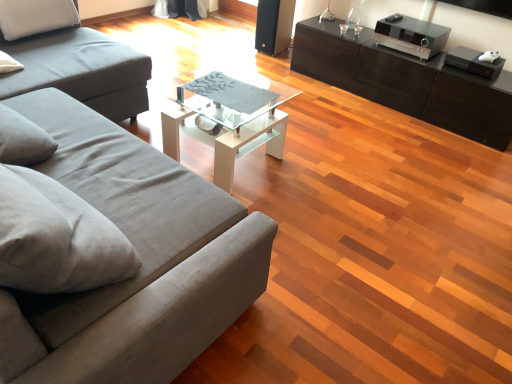
Question: Are clear glass coffee table at center and matte gray fabric studio couch at left, arranged as the 1th studio couch when viewed from the back, making contact?

Choices:
 (A) no
 (B) yes

Answer: (A)

Question: Could you tell me if clear glass coffee table at center is turned towards matte gray fabric studio couch at left, arranged as the 2th studio couch when viewed from the front?

Choices:
 (A) yes
 (B) no

Answer: (B)

Question: Is matte gray fabric studio couch at left, arranged as the 1th studio couch when viewed from the back, surrounded by clear glass coffee table at center?

Choices:
 (A) yes
 (B) no

Answer: (B)

Question: From a real-world perspective, is clear glass coffee table at center positioned under matte gray fabric studio couch at left, arranged as the 1th studio couch when viewed from the back, based on gravity?

Choices:
 (A) no
 (B) yes

Answer: (B)

Question: Is clear glass coffee table at center wider than matte gray fabric studio couch at left, arranged as the 1th studio couch when viewed from the back?

Choices:
 (A) no
 (B) yes

Answer: (A)

Question: Is gray fabric couch at left, the first studio couch when ordered from front to back, inside or outside of clear glass coffee table at center?

Choices:
 (A) inside
 (B) outside

Answer: (B)

Question: Considering the positions of gray fabric couch at left, the first studio couch when ordered from front to back, and clear glass coffee table at center in the image, is gray fabric couch at left, the first studio couch when ordered from front to back, wider or thinner than clear glass coffee table at center?

Choices:
 (A) thin
 (B) wide

Answer: (B)

Question: Is gray fabric couch at left, the first studio couch when ordered from front to back, in front of or behind clear glass coffee table at center in the image?

Choices:
 (A) behind
 (B) front

Answer: (B)

Question: From their relative heights in the image, would you say gray fabric couch at left, the second studio couch positioned from the back, is taller or shorter than clear glass coffee table at center?

Choices:
 (A) short
 (B) tall

Answer: (B)

Question: In terms of height, does gray fabric couch at left, the second studio couch positioned from the back, look taller or shorter compared to black glossy cabinet at right?

Choices:
 (A) short
 (B) tall

Answer: (B)

Question: From a real-world perspective, is gray fabric couch at left, the second studio couch positioned from the back, physically located above or below black glossy cabinet at right?

Choices:
 (A) above
 (B) below

Answer: (A)

Question: Does point (201, 304) appear closer or farther from the camera than point (292, 54)?

Choices:
 (A) closer
 (B) farther

Answer: (A)

Question: Considering the positions of gray fabric couch at left, the first studio couch when ordered from front to back, and black glossy cabinet at right in the image, is gray fabric couch at left, the first studio couch when ordered from front to back, bigger or smaller than black glossy cabinet at right?

Choices:
 (A) small
 (B) big

Answer: (B)

Question: In terms of height, does matte gray fabric studio couch at left, arranged as the 1th studio couch when viewed from the back, look taller or shorter compared to black glossy cabinet at right?

Choices:
 (A) short
 (B) tall

Answer: (B)

Question: Considering the positions of point (110, 52) and point (488, 142), is point (110, 52) closer or farther from the camera than point (488, 142)?

Choices:
 (A) farther
 (B) closer

Answer: (B)